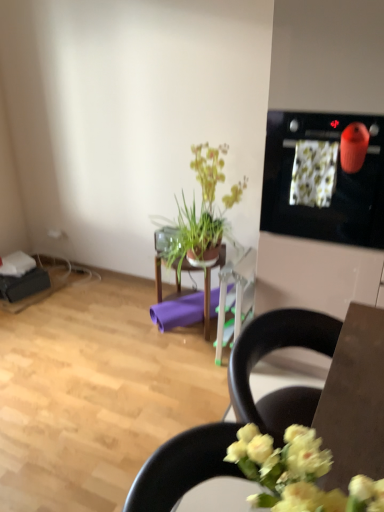
Question: From the image's perspective, is purple matte yoga mat at center positioned above or below black plastic chair at lower right?

Choices:
 (A) below
 (B) above

Answer: (B)

Question: Considering their positions, is purple matte yoga mat at center located in front of or behind black plastic chair at lower right?

Choices:
 (A) behind
 (B) front

Answer: (A)

Question: Considering the real-world distances, which object is closest to the purple matte yoga mat at center?

Choices:
 (A) black glossy oven at upper right
 (B) green leafy plant at center
 (C) black plastic chair at lower right
 (D) wooden table at center

Answer: (D)

Question: Estimate the real-world distances between objects in this image. Which object is farther from the black plastic chair at lower right?

Choices:
 (A) black glossy oven at upper right
 (B) purple matte yoga mat at center
 (C) green leafy plant at center
 (D) wooden table at center

Answer: (C)